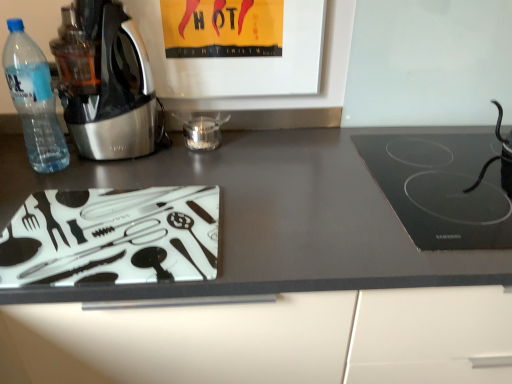
Identify the location of free location above matte glass cutting board at lower left (from a real-world perspective). The height and width of the screenshot is (384, 512). (234, 185).